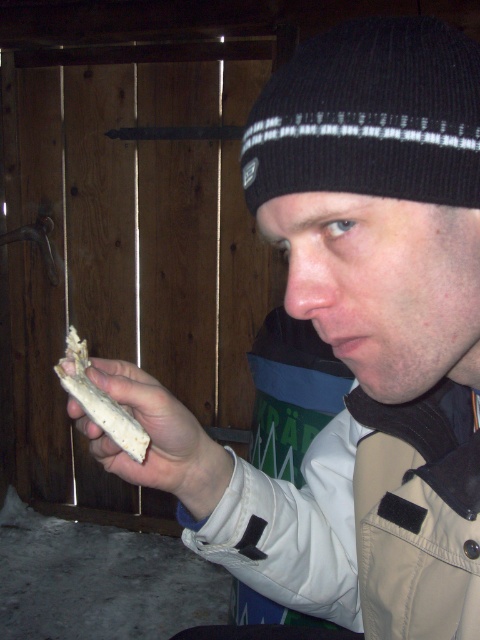
You are an interior designer assessing the spatial arrangement of the room. The black knit beanie at upper center and the light brown leather hand at center are both visible in the frame. Which object appears higher up in the image?

The black knit beanie at upper center appears higher up in the image because it is taller than the light brown leather hand at center.

You are a chef observing a scene where a light brown leather hand at center is holding a white crumbly bread at center. Based on their heights, which object is closer to the viewer?

Answer: The light brown leather hand at center has a greater height compared to the white crumbly bread at center, so the hand is closer to the viewer since objects closer appear larger.